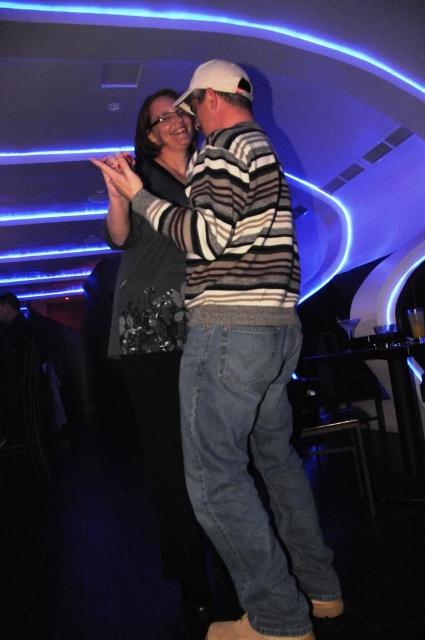
Question: Can you confirm if striped sweater at center is thinner than shiny silver dress at center?

Choices:
 (A) no
 (B) yes

Answer: (A)

Question: Which of the following is the closest to the observer?

Choices:
 (A) (146, 248)
 (B) (238, 124)

Answer: (B)

Question: Which point is farther to the camera?

Choices:
 (A) (285, 193)
 (B) (150, 145)

Answer: (B)

Question: Does striped sweater at center appear on the left side of shiny silver dress at center?

Choices:
 (A) yes
 (B) no

Answer: (B)

Question: Can you confirm if striped sweater at center is positioned to the left of shiny silver dress at center?

Choices:
 (A) no
 (B) yes

Answer: (A)